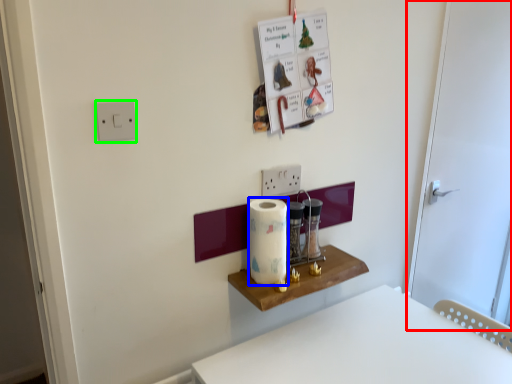
Question: Which is farther away from door (highlighted by a red box)? paper towel (highlighted by a blue box) or light switch (highlighted by a green box)?

Choices:
 (A) paper towel
 (B) light switch

Answer: (B)